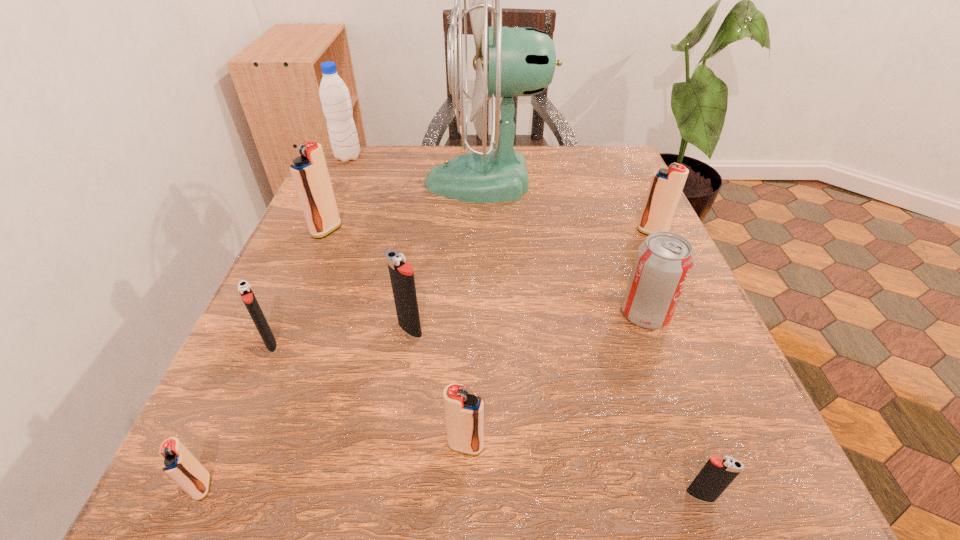
You are a GUI agent. You are given a task and a screenshot of the screen. Output one action in this format:
    pyautogui.click(x=<x>, y=<y>)
    Task: Click on the free spot that satisfies the following two spatial constraints: 1. in front of the fan, directing airflow; 2. on the right side of the soda can
    
    Given the screenshot: What is the action you would take?
    pyautogui.click(x=490, y=314)